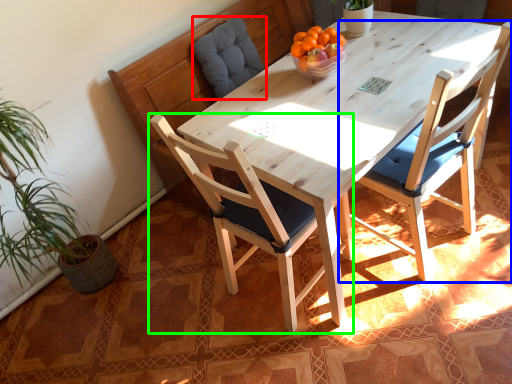
Question: Which is nearer to the swivel chair (highlighted by a red box)? chair (highlighted by a blue box) or chair (highlighted by a green box).

Choices:
 (A) chair
 (B) chair

Answer: (B)